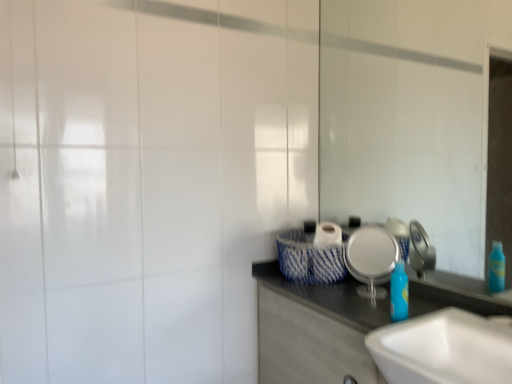
Question: Considering the positions of point (403, 276) and point (376, 233), is point (403, 276) closer or farther from the camera than point (376, 233)?

Choices:
 (A) closer
 (B) farther

Answer: (A)

Question: From the image's perspective, relative to silver metallic plate at center, is blue plastic bottle at center above or below?

Choices:
 (A) above
 (B) below

Answer: (B)

Question: Estimate the real-world distances between objects in this image. Which object is farther from the blue plastic bottle at center?

Choices:
 (A) white glossy sink at lower right
 (B) white glossy mirror at upper right
 (C) silver metallic plate at center
 (D) white glossy cabinet at lower right

Answer: (B)

Question: Considering the real-world distances, which object is farthest from the silver metallic plate at center?

Choices:
 (A) blue plastic bottle at center
 (B) white glossy mirror at upper right
 (C) white glossy sink at lower right
 (D) white glossy cabinet at lower right

Answer: (B)